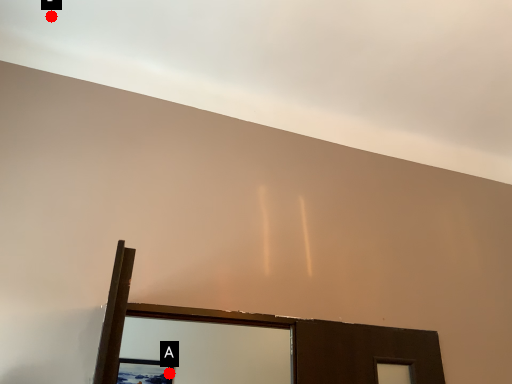
Question: Two points are circled on the image, labeled by A and B beside each circle. Which point appears farthest from the camera in this image?

Choices:
 (A) A is further
 (B) B is further

Answer: (A)